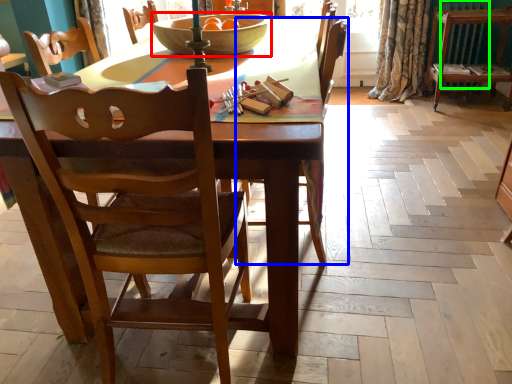
Question: Considering the real-world distances, which object is farthest from bowl (highlighted by a red box)? chair (highlighted by a blue box) or radiator (highlighted by a green box)?

Choices:
 (A) chair
 (B) radiator

Answer: (B)